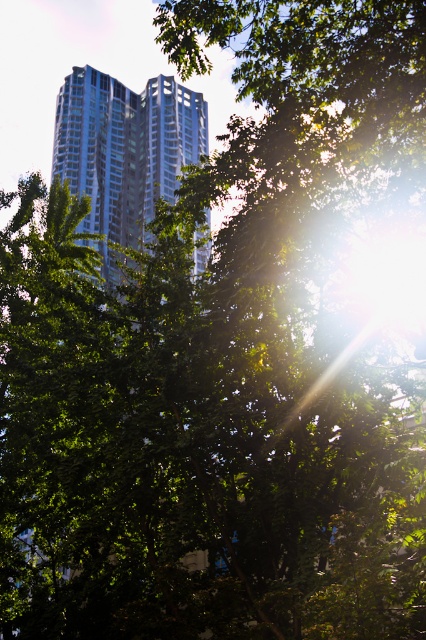
You are standing in a park and see both the glassy reflective building at center and the glassy silver skyscraper at center. Which one is closer to you?

The glassy reflective building at center is closer because it is located below the glassy silver skyscraper at center, indicating it is in a lower position relative to the observer.